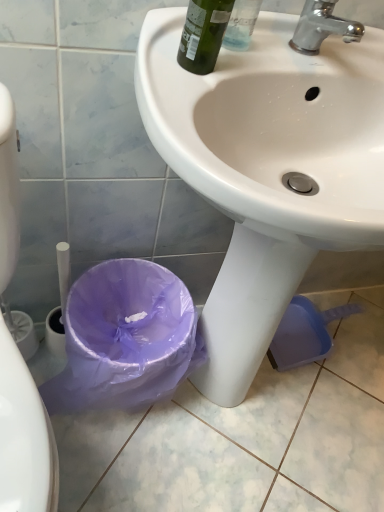
This screenshot has width=384, height=512. I want to click on vacant space to the right of purple plastic bag at lower left, so coord(230,428).